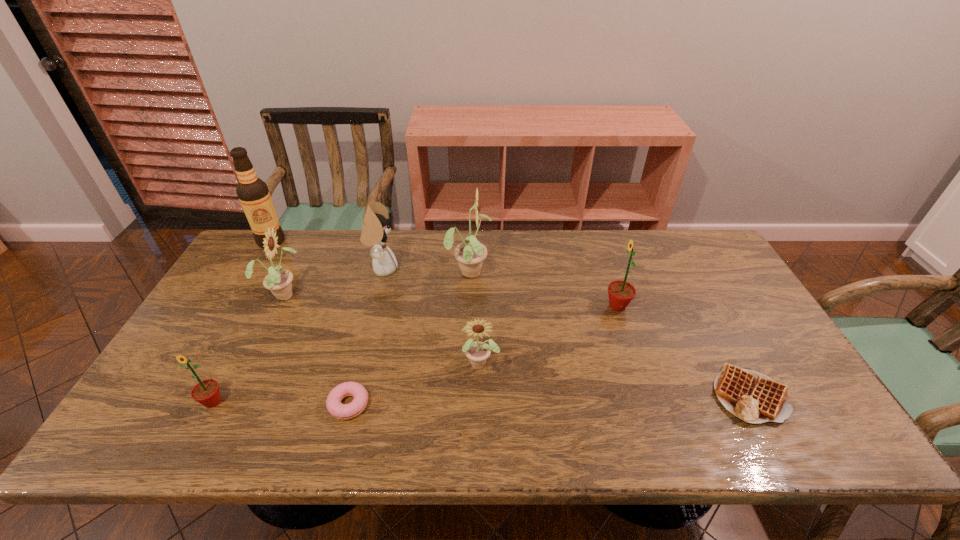
You are a GUI agent. You are given a task and a screenshot of the screen. Output one action in this format:
    pyautogui.click(x=<x>, y=<y>)
    Task: Click on the free spot between the tallest sunflower and the nearer green sunflower
    The width and height of the screenshot is (960, 540).
    Given the screenshot: What is the action you would take?
    pyautogui.click(x=341, y=336)

Where is `blank region between the waffle and the left green sunflower`? The height and width of the screenshot is (540, 960). blank region between the waffle and the left green sunflower is located at coordinates (481, 398).

I want to click on vacant area that lies between the leftmost yellow sunflower and the nearer green sunflower, so click(249, 348).

Find the location of a particular element. The width and height of the screenshot is (960, 540). free space between the alcohol and the rightmost object is located at coordinates (510, 318).

This screenshot has width=960, height=540. I want to click on the closest object to the doughnut, so [x=477, y=352].

Identify which object is located as the seventh nearest to the waffle. Please provide its 2D coordinates. Your answer should be formatted as a tuple, i.e. [(x, y)], where the tuple contains the x and y coordinates of a point satisfying the conditions above.

[(206, 392)]

Where is `sunflower that can be found as the fourth closest to the smallest yellow sunflower`? Image resolution: width=960 pixels, height=540 pixels. sunflower that can be found as the fourth closest to the smallest yellow sunflower is located at coordinates (206, 392).

This screenshot has height=540, width=960. What are the coordinates of `sunflower that is the second closest to the beige alcohol` in the screenshot? It's located at (206, 392).

Locate which yellow sunflower is the third closest to the right green sunflower. Please provide its 2D coordinates. Your answer should be formatted as a tuple, i.e. [(x, y)], where the tuple contains the x and y coordinates of a point satisfying the conditions above.

[(278, 281)]

The height and width of the screenshot is (540, 960). What are the coordinates of `the closest yellow sunflower relative to the right green sunflower` in the screenshot? It's located at [470, 254].